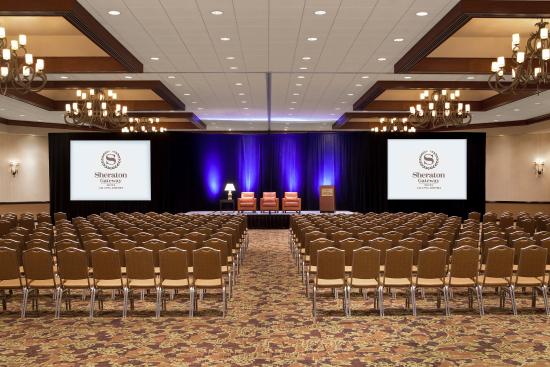
Locate an element on the screen. The image size is (550, 367). floor is located at coordinates pyautogui.click(x=277, y=302).